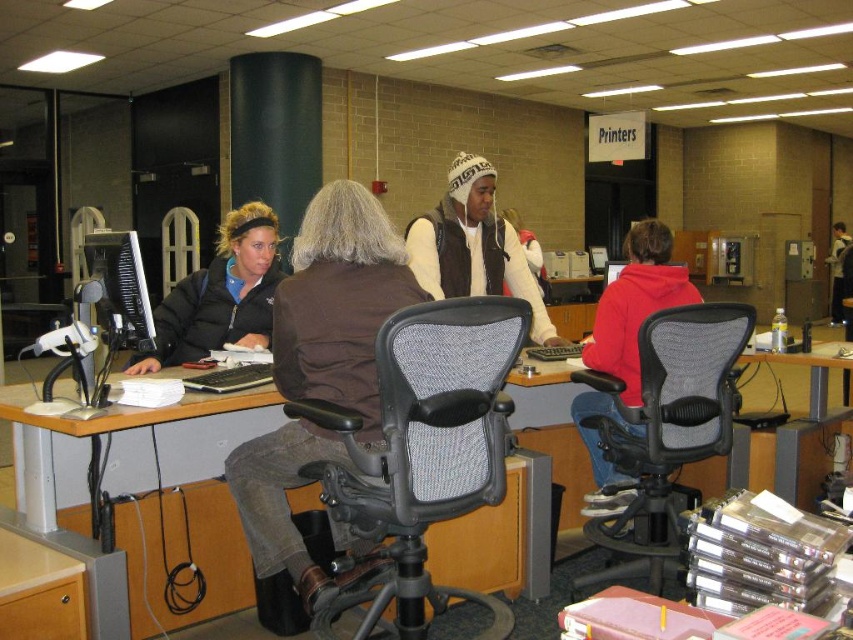
You are standing at the point labeled as point (x=401, y=557) and want to see if you can see the point labeled point (x=850, y=365). Based on the spatial relationship between these two points, can you see the other point from your current position?

Point (x=850, y=365) is behind point (x=401, y=557), so you cannot see point (x=850, y=365) from your current position at point (x=401, y=557) because it is obstructed by the object in front.

You are a visitor in this office and need to sit down next to the person in the red fleece hoodie at center. Which direction should you move relative to the black mesh swivel chair at center to reach the seat next to them?

You should move to the right side of the black mesh swivel chair at center to sit next to the red fleece hoodie at center, as the black mesh swivel chair at center is on the left side of the red fleece hoodie at center.